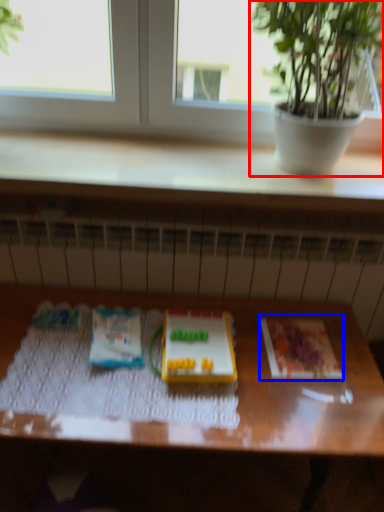
Question: Among these objects, which one is farthest to the camera, houseplant (highlighted by a red box) or paperback book (highlighted by a blue box)?

Choices:
 (A) houseplant
 (B) paperback book

Answer: (B)